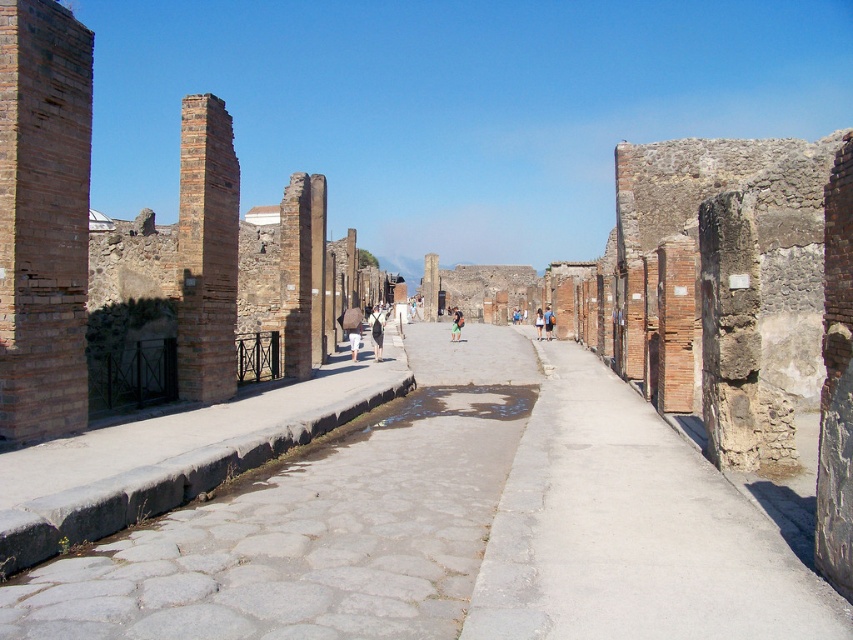
Question: Estimate the real-world distances between objects in this image. Which object is farther from the smooth stone pillar at center?

Choices:
 (A) blue fabric dress at center
 (B) light brown leather backpack at center
 (C) denim shorts at center

Answer: (B)

Question: Does gray stone alley at center have a smaller size compared to green fabric bag at center?

Choices:
 (A) no
 (B) yes

Answer: (B)

Question: Is gray stone alley at center thinner than denim shorts at center?

Choices:
 (A) no
 (B) yes

Answer: (A)

Question: Among these objects, which one is farthest from the camera?

Choices:
 (A) smooth stone pillar at center
 (B) gray stone alley at center
 (C) blue fabric dress at center
 (D) light brown leather backpack at center

Answer: (A)

Question: Which object appears closest to the camera in this image?

Choices:
 (A) light brown leather backpack at center
 (B) brick wall at left
 (C) smooth stone pillar at center
 (D) brown brick pillar at left

Answer: (B)

Question: In this image, where is brick wall at left located relative to denim shorts at center?

Choices:
 (A) below
 (B) above

Answer: (B)